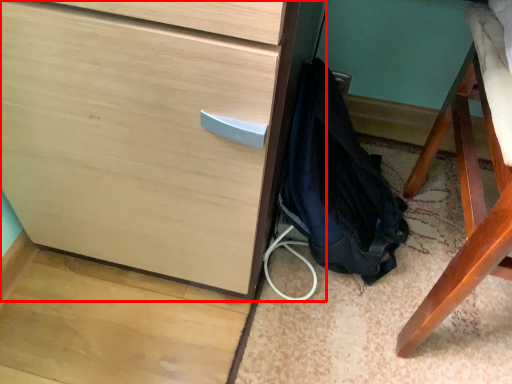
Question: Observing the image, what is the correct spatial positioning of chest of drawers (annotated by the red box) in reference to backpack?

Choices:
 (A) left
 (B) right

Answer: (B)